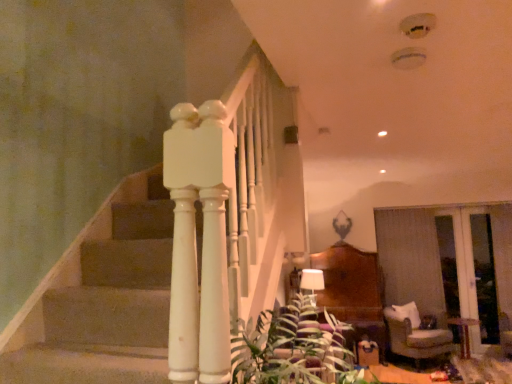
Question: Does transparent glass door at right contain beige fabric armchair at lower right?

Choices:
 (A) yes
 (B) no

Answer: (B)

Question: Does transparent glass door at right have a greater width compared to beige fabric armchair at lower right?

Choices:
 (A) no
 (B) yes

Answer: (A)

Question: Is transparent glass door at right positioned with its back to beige fabric armchair at lower right?

Choices:
 (A) yes
 (B) no

Answer: (B)

Question: Can you confirm if transparent glass door at right is taller than beige fabric armchair at lower right?

Choices:
 (A) yes
 (B) no

Answer: (A)

Question: Does transparent glass door at right have a lesser height compared to beige fabric armchair at lower right?

Choices:
 (A) no
 (B) yes

Answer: (A)

Question: Could you tell me if transparent glass door at right is turned towards beige fabric armchair at lower right?

Choices:
 (A) no
 (B) yes

Answer: (A)

Question: From a real-world perspective, is beige fabric armchair at lower right on top of white fabric lampshade at center?

Choices:
 (A) no
 (B) yes

Answer: (A)

Question: Is beige fabric armchair at lower right further to camera compared to white fabric lampshade at center?

Choices:
 (A) no
 (B) yes

Answer: (A)

Question: Would you say beige fabric armchair at lower right is a long distance from white fabric lampshade at center?

Choices:
 (A) no
 (B) yes

Answer: (B)

Question: Is beige fabric armchair at lower right thinner than white fabric lampshade at center?

Choices:
 (A) yes
 (B) no

Answer: (B)

Question: Is beige fabric armchair at lower right completely or partially outside of white fabric lampshade at center?

Choices:
 (A) no
 (B) yes

Answer: (B)

Question: From a real-world perspective, does beige fabric armchair at lower right sit lower than white fabric lampshade at center?

Choices:
 (A) yes
 (B) no

Answer: (A)

Question: Is white fabric lampshade at center taller than green leafy plant at lower center?

Choices:
 (A) yes
 (B) no

Answer: (B)